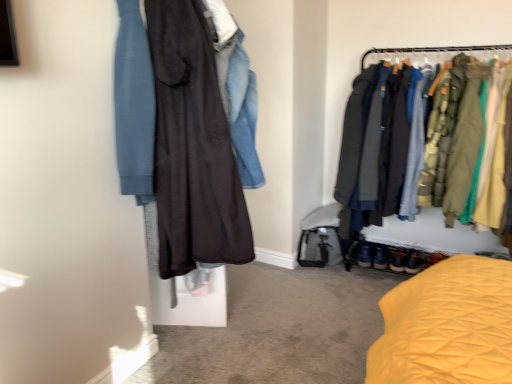
Question: Is textured fabric jackets at right in front of or behind leather brown shoes at lower right in the image?

Choices:
 (A) front
 (B) behind

Answer: (A)

Question: From the image's perspective, is textured fabric jackets at right above or below leather brown shoes at lower right?

Choices:
 (A) above
 (B) below

Answer: (A)

Question: Estimate the real-world distances between objects in this image. Which object is farther from the textured fabric jackets at right?

Choices:
 (A) leather brown shoes at lower right
 (B) dark matte dress at center

Answer: (B)

Question: Based on their relative distances, which object is farther from the dark matte dress at center?

Choices:
 (A) textured fabric jackets at right
 (B) leather brown shoes at lower right

Answer: (B)